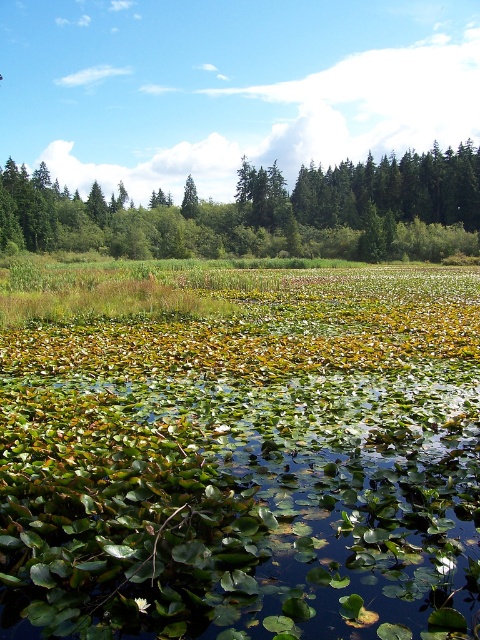
Question: From the image, what is the correct spatial relationship of green leafy water at center in relation to green leafy tree at left?

Choices:
 (A) above
 (B) below

Answer: (B)

Question: Can you confirm if green leafy water at center is positioned above green matte tree at center?

Choices:
 (A) no
 (B) yes

Answer: (A)

Question: Is green leafy tree at left to the left of green matte tree at center from the viewer's perspective?

Choices:
 (A) no
 (B) yes

Answer: (A)

Question: Among these points, which one is farthest from the camera?

Choices:
 (A) (479, 244)
 (B) (194, 195)

Answer: (B)

Question: Based on their relative distances, which object is farther from the green leafy water at center?

Choices:
 (A) green leafy tree at left
 (B) green matte tree at center

Answer: (B)

Question: Which of the following is the farthest from the observer?

Choices:
 (A) tap(109, 636)
 (B) tap(276, 177)
 (C) tap(189, 186)

Answer: (B)